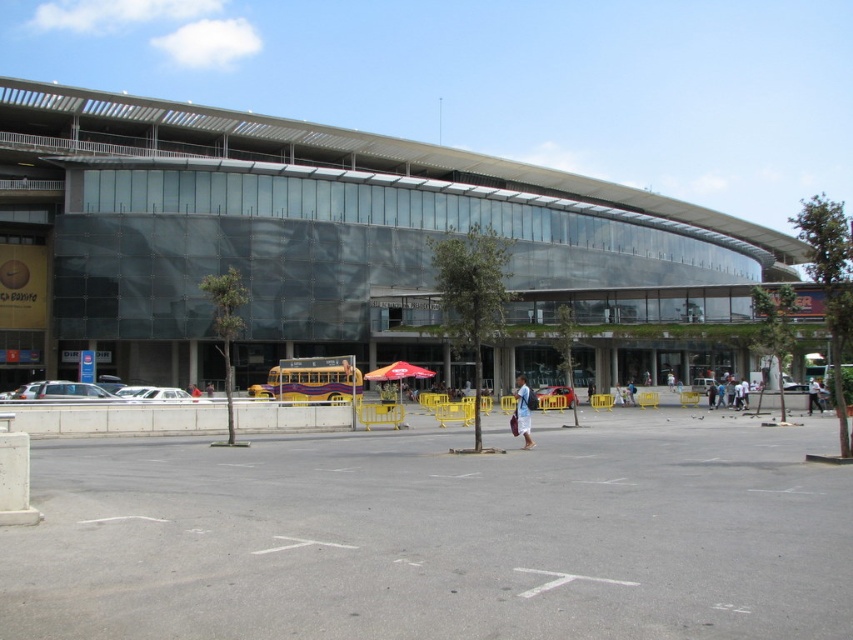
Is gray asphalt parking lot at center closer to camera compared to white fabric bag at center?

Yes, gray asphalt parking lot at center is in front of white fabric bag at center.

Locate an element on the screen. gray asphalt parking lot at center is located at coordinates (439, 536).

The image size is (853, 640). I want to click on gray asphalt parking lot at center, so click(x=439, y=536).

Can you confirm if gray asphalt parking lot at center is positioned to the right of blue fabric bag at center?

In fact, gray asphalt parking lot at center is to the left of blue fabric bag at center.

Who is more distant from viewer, (317, 595) or (514, 413)?

The point (514, 413) is behind.

The width and height of the screenshot is (853, 640). In order to click on gray asphalt parking lot at center in this screenshot , I will do `click(439, 536)`.

Consider the image. Who is positioned more to the right, transparent glass building at center or blue fabric bag at center?

From the viewer's perspective, transparent glass building at center appears more on the right side.

Is point (439, 193) in front of point (517, 410)?

No, (439, 193) is further to viewer.

Which is in front, point (225, 150) or point (527, 438)?

Positioned in front is point (527, 438).

The width and height of the screenshot is (853, 640). Find the location of `transparent glass building at center`. transparent glass building at center is located at coordinates click(x=335, y=248).